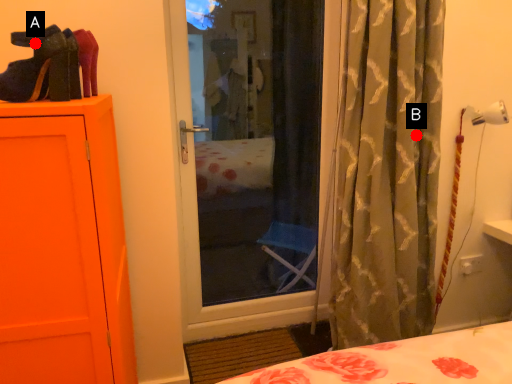
Question: Two points are circled on the image, labeled by A and B beside each circle. Which point is farther to the camera?

Choices:
 (A) A is further
 (B) B is further

Answer: (B)